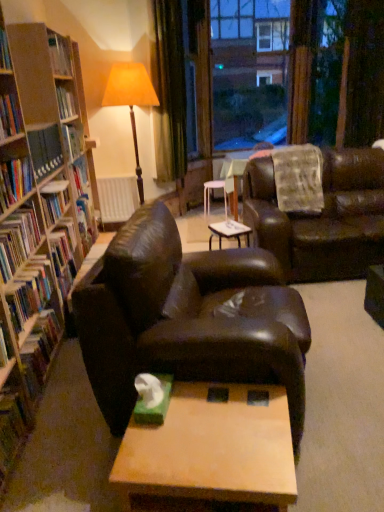
This screenshot has width=384, height=512. I want to click on vacant space in front of green matte tissue box at center, so click(x=158, y=439).